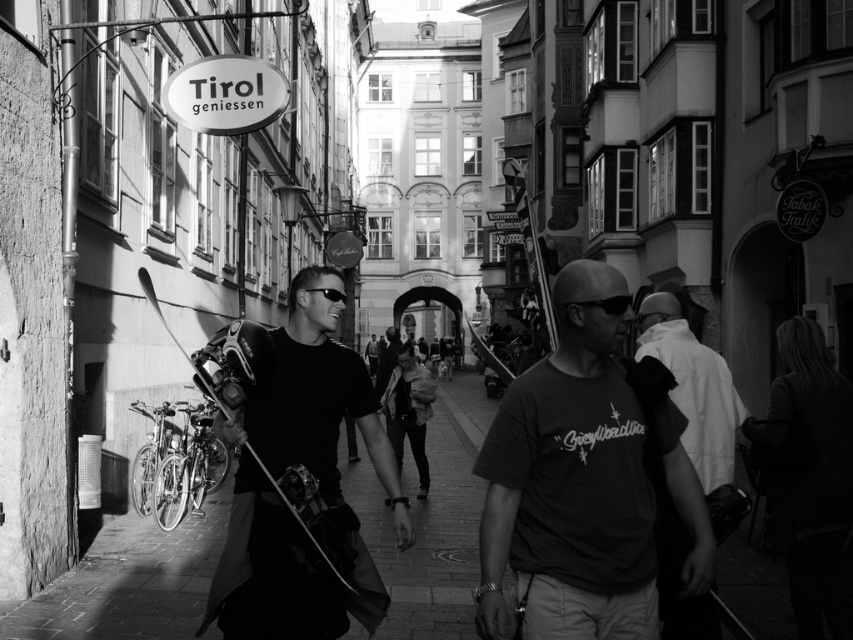
Question: Which of the following is the closest to the observer?

Choices:
 (A) matte black goggles at center
 (B) black matte skateboard at center

Answer: (B)

Question: Can you confirm if dark gray t-shirt at center is positioned above black matte skateboard at center?

Choices:
 (A) yes
 (B) no

Answer: (B)

Question: Does white cotton shirt at right appear on the left side of matte black goggles at center?

Choices:
 (A) yes
 (B) no

Answer: (B)

Question: Does black matte skateboard at center lie in front of white cotton shirt at right?

Choices:
 (A) no
 (B) yes

Answer: (A)

Question: Which object is positioned farthest from the white cotton shirt at right?

Choices:
 (A) matte black goggles at center
 (B) dark gray t-shirt at center
 (C) dark fabric bag at right

Answer: (B)

Question: Estimate the real-world distances between objects in this image. Which object is farther from the dark fabric bag at right?

Choices:
 (A) white cotton shirt at right
 (B) smooth concrete pavement at center
 (C) black matte skateboard at center
 (D) matte black goggles at center

Answer: (B)